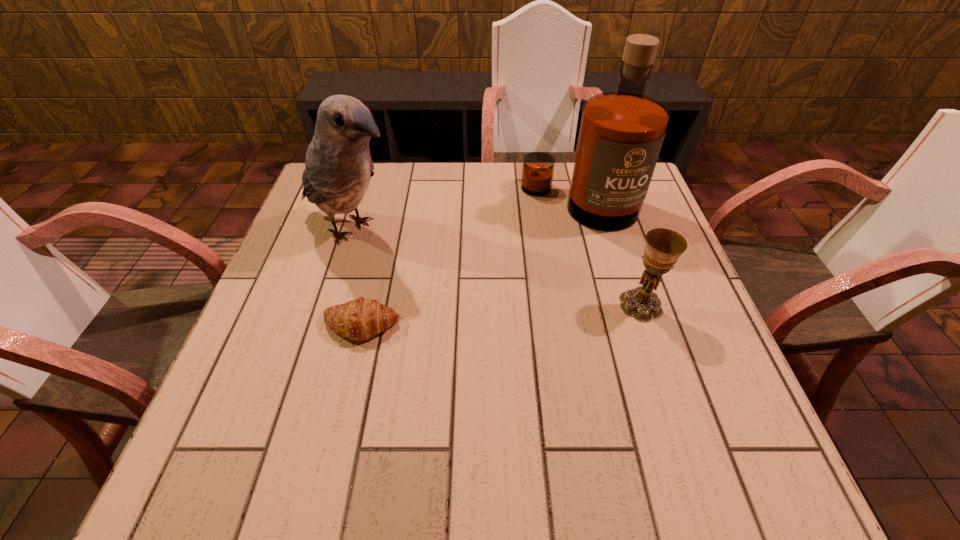
The height and width of the screenshot is (540, 960). In the image, there is a desktop. Find the location of `free region at the far edge`. free region at the far edge is located at coordinates (383, 181).

You are a GUI agent. You are given a task and a screenshot of the screen. Output one action in this format:
    pyautogui.click(x=<x>, y=<y>)
    Task: Click on the free space at the near edge of the desktop
    
    Given the screenshot: What is the action you would take?
    pyautogui.click(x=491, y=417)

I want to click on vacant space at the left edge, so [x=265, y=342].

In the image, there is a desktop. At what (x,y) coordinates should I click in order to perform the action: click on vacant space at the right edge. Please return your answer as a coordinate pair (x, y). Looking at the image, I should click on coord(645,344).

At what (x,y) coordinates should I click in order to perform the action: click on free space between the third shortest object and the shortest object. Please return your answer as a coordinate pair (x, y). Looking at the image, I should click on (356, 277).

You are a GUI agent. You are given a task and a screenshot of the screen. Output one action in this format:
    pyautogui.click(x=<x>, y=<y>)
    Task: Click on the vacant point located between the crescent roll and the liquor
    The width and height of the screenshot is (960, 540).
    Given the screenshot: What is the action you would take?
    pyautogui.click(x=469, y=265)

At what (x,y) coordinates should I click in order to perform the action: click on free spot between the liquor and the shortest object. Please return your answer as a coordinate pair (x, y). Looking at the image, I should click on (469, 265).

Locate an element on the screen. vacant point located between the shortest object and the second tallest object is located at coordinates (356, 277).

Where is `vacant space in between the liquor and the third tallest object`? vacant space in between the liquor and the third tallest object is located at coordinates (x=610, y=254).

Where is `empty space between the crescent roll and the parrot`? The width and height of the screenshot is (960, 540). empty space between the crescent roll and the parrot is located at coordinates (356, 277).